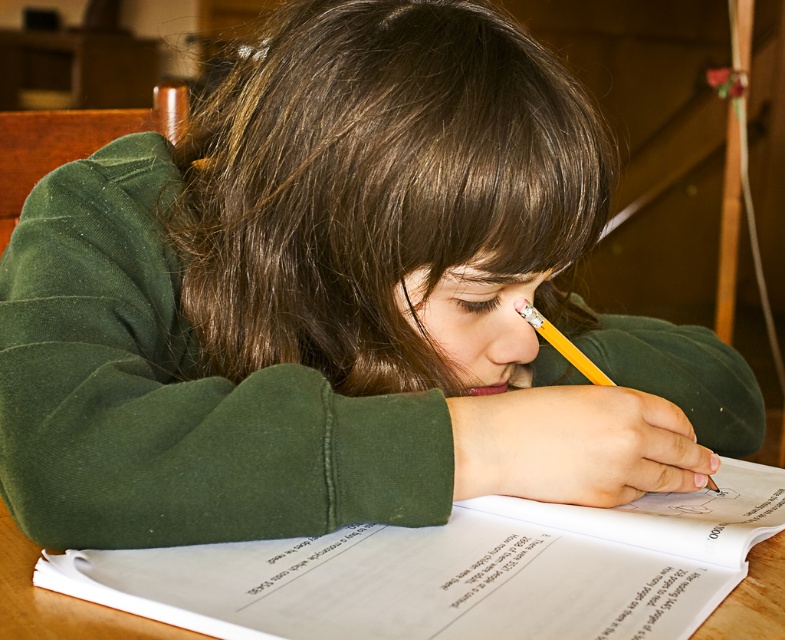
You are a student who needs to place a small eraser on the wooden table at center. Based on the image, where should you place it relative to the yellow wood pencil at upper center?

The wooden table at center is located below the yellow wood pencil at upper center, so you should place the eraser on the table below the pencil.

You are a teacher observing a student working at the wooden table at center. You notice the white paper at lower center that the student is using. If the student wants to slide the paper closer to the edge of the table, will it fit without hanging over the edge? The table has a standard edge safety margin of 1 inch required for stability.

The distance between the wooden table at center and the white paper at lower center is 2.60 inches. Since the required safety margin is 1 inch, subtracting this from the current distance leaves 1.60 inches. This means the white paper at lower center can be slid closer to the edge, but it will still have 1.60 inches of space before reaching the edge, so it won not hang over the edge.